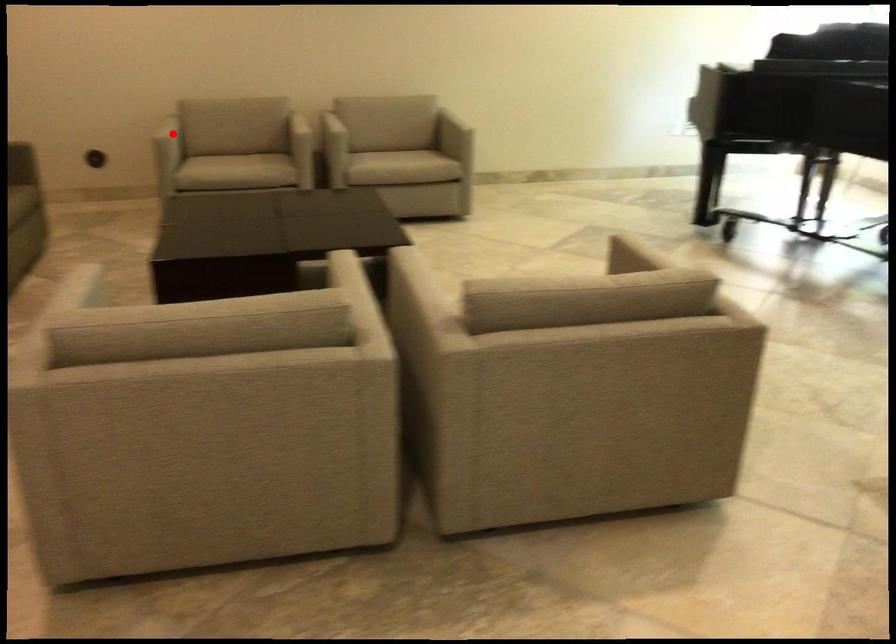
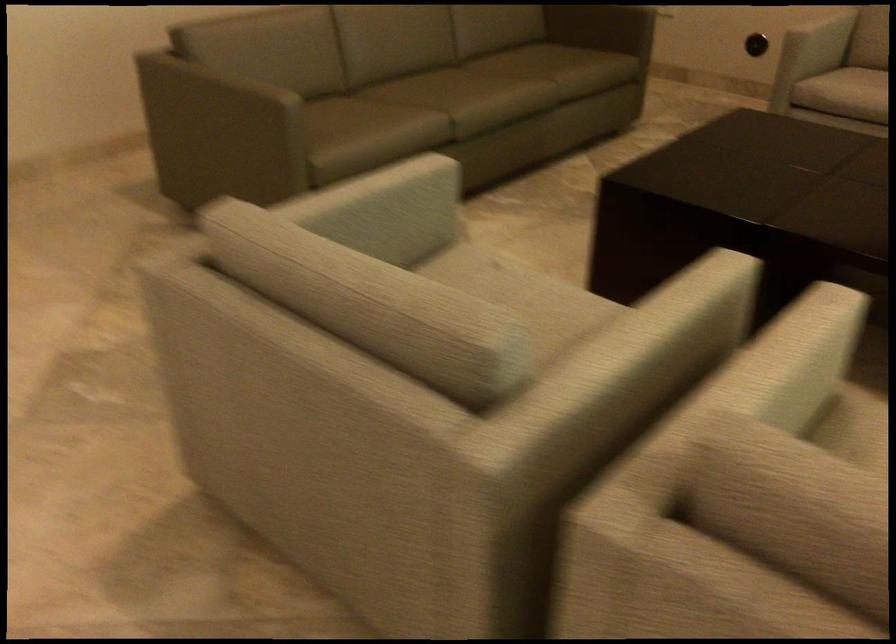
Find the pixel in the second image that matches the highlighted location in the first image.

(821, 35)